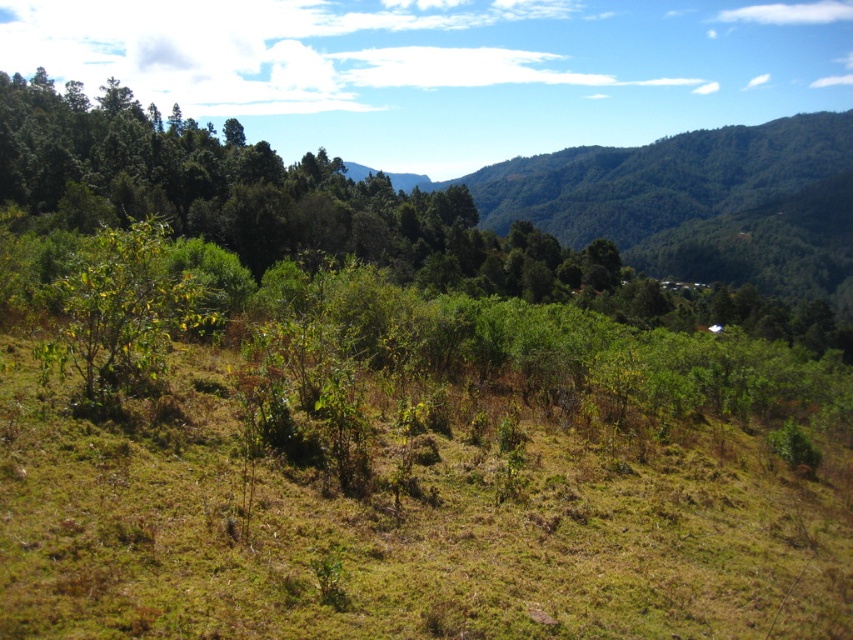
Looking at this image, you are standing in the middle of the green grassy at center and want to look at the green leafy shrub at center. Which direction should you move to get a better view of the shrub?

Since the green grassy at center is in front of the green leafy shrub at center, you should move backward to get a better view of the shrub.

You are planning to plant a new flower bed in the center of the image. The flower bed requires an area wider than the green leafy shrub at center. Can the green grassy at center provide enough space for this flower bed?

The green grassy at center has a width less than the green leafy shrub at center, so it cannot provide enough space for the flower bed that requires an area wider than the green leafy shrub at center.

You are standing in the middle of the green grassy at center and want to reach the green leafy shrub at center. Which direction should you move to get closer to the shrub?

The green grassy at center is located below the green leafy shrub at center, so you should move upward to reach the shrub.